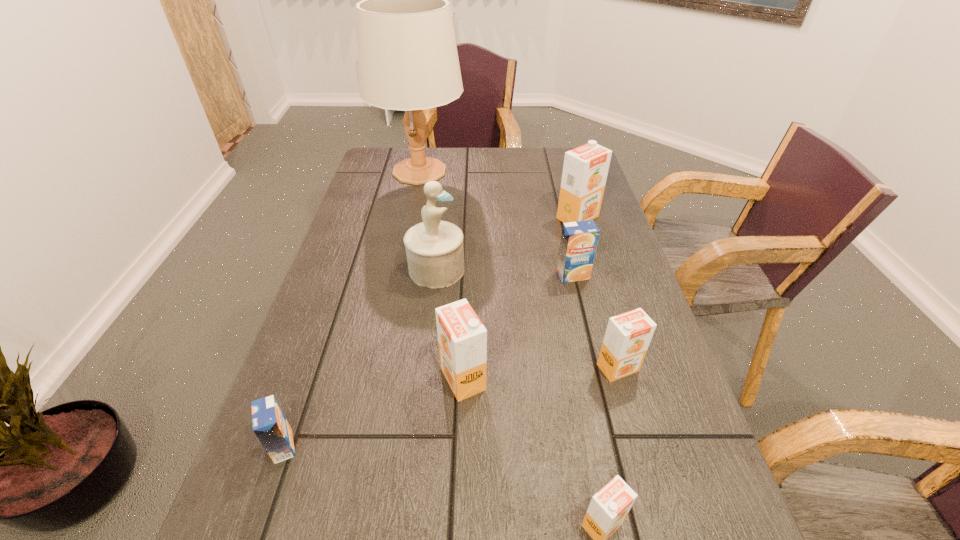
Locate an element on the screen. Image resolution: width=960 pixels, height=540 pixels. vacant space that is in between the figurine and the third biggest orange orange juice is located at coordinates (527, 319).

Identify the location of vacant area that lies between the farthest orange orange juice and the seventh farthest object. (430, 332).

Image resolution: width=960 pixels, height=540 pixels. What are the coordinates of `unoccupied position between the fifth nearest orange juice and the figurine` in the screenshot? It's located at [x=505, y=272].

Select which object is the third closest to the farthest orange juice. Please provide its 2D coordinates. Your answer should be formatted as a tuple, i.e. [(x, y)], where the tuple contains the x and y coordinates of a point satisfying the conditions above.

[(435, 253)]

Where is `the sixth closest object to the fifth orange juice from right to left`? the sixth closest object to the fifth orange juice from right to left is located at coordinates (585, 169).

Identify the location of orange juice that can be found as the closest to the beige table lamp. (585, 169).

I want to click on orange juice that is the closest to the nearest orange juice, so click(x=628, y=335).

Choose which orange orange juice is the nearest neighbor to the second farthest orange juice. Please provide its 2D coordinates. Your answer should be formatted as a tuple, i.e. [(x, y)], where the tuple contains the x and y coordinates of a point satisfying the conditions above.

[(585, 169)]

Where is `the closest orange orange juice to the fourth tallest object`? This screenshot has height=540, width=960. the closest orange orange juice to the fourth tallest object is located at coordinates [x=628, y=335].

The height and width of the screenshot is (540, 960). I want to click on vacant region that satisfies the following two spatial constraints: 1. on the front side of the beige table lamp; 2. on the left side of the third biggest orange orange juice, so click(x=379, y=368).